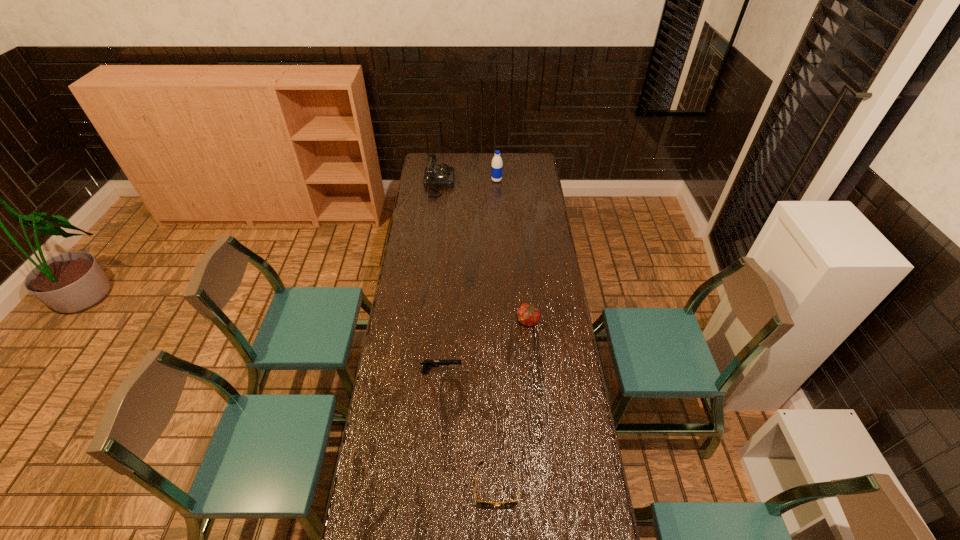
In the image, there is a desktop. Where is `vacant region at the far right corner`? vacant region at the far right corner is located at coordinates (532, 168).

Where is `vacant space in between the second nearest object and the telephone`? The image size is (960, 540). vacant space in between the second nearest object and the telephone is located at coordinates pos(441,278).

The image size is (960, 540). I want to click on free space that is in between the second nearest object and the rightmost object, so click(485, 347).

Identify the location of empty location between the nearest object and the gun. Image resolution: width=960 pixels, height=540 pixels. 468,429.

This screenshot has width=960, height=540. In order to click on free space between the second tallest object and the nearest object in this screenshot , I will do `click(468, 334)`.

Where is `free space between the fourth shortest object and the water bottle`? free space between the fourth shortest object and the water bottle is located at coordinates (468, 182).

The image size is (960, 540). What are the coordinates of `vacant area that lies between the tallest object and the telephone` in the screenshot? It's located at (468, 182).

At what (x,y) coordinates should I click in order to perform the action: click on free area in between the rightmost object and the gun. Please return your answer as a coordinate pair (x, y). The width and height of the screenshot is (960, 540). Looking at the image, I should click on (485, 347).

Point out which object is positioned as the nearest to the water bottle. Please provide its 2D coordinates. Your answer should be formatted as a tuple, i.e. [(x, y)], where the tuple contains the x and y coordinates of a point satisfying the conditions above.

[(435, 176)]

The height and width of the screenshot is (540, 960). Identify the location of object identified as the third closest to the tallest object. (427, 364).